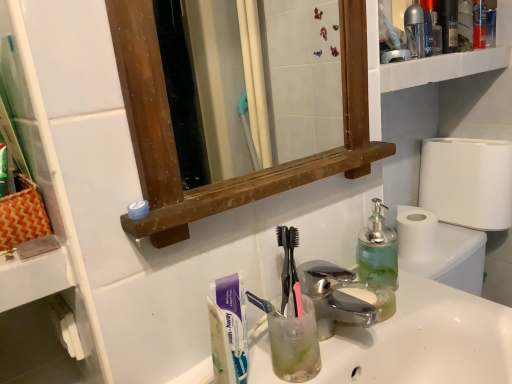
Identify the location of unoccupied region to the right of green translucent soap dispenser at right, positioned as the second bottle in right-to-left order. (434, 292).